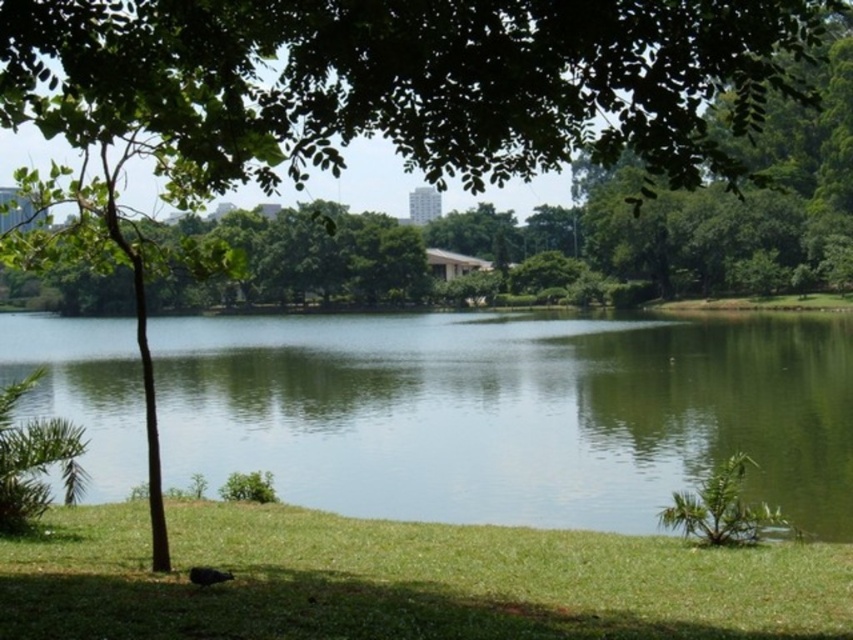
Does point (614, 422) lie in front of point (350, 554)?

No.

Describe the element at coordinates (511, 412) in the screenshot. I see `green smooth water at center` at that location.

Locate an element on the screen. This screenshot has width=853, height=640. green smooth water at center is located at coordinates tap(511, 412).